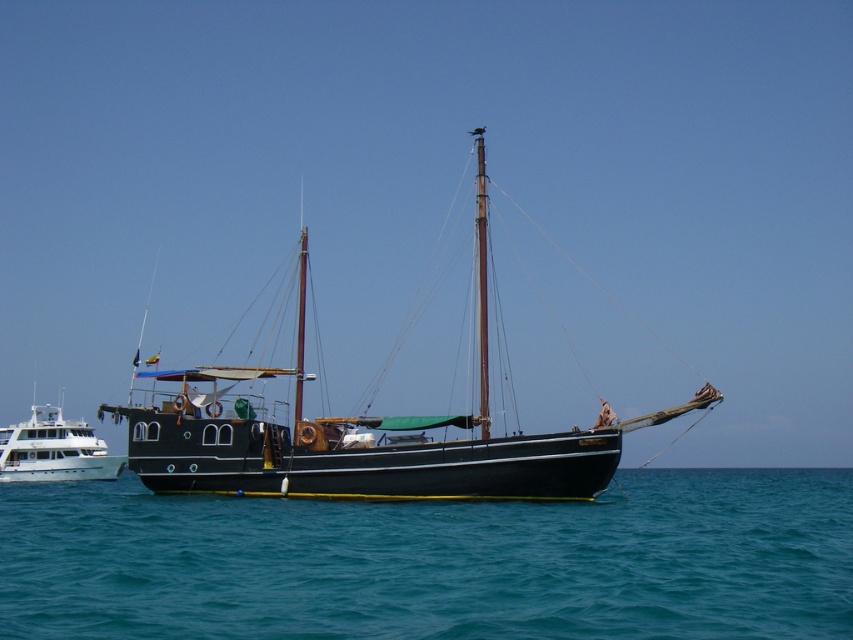
Does point (9, 618) come in front of point (519, 493)?

Yes, point (9, 618) is in front of point (519, 493).

Locate an element on the screen. blue water at lower center is located at coordinates (434, 561).

Identify the location of blue water at lower center. (434, 561).

Is point (502, 540) positioned before point (48, 456)?

Yes.

Measure the distance from blue water at lower center to white glossy yacht at left.

A distance of 49.49 meters exists between blue water at lower center and white glossy yacht at left.

Which is behind, point (109, 563) or point (56, 420)?

Positioned behind is point (56, 420).

This screenshot has height=640, width=853. Identify the location of blue water at lower center. (434, 561).

Is black polished wood sailboat at center positioned behind white glossy yacht at left?

No, it is in front of white glossy yacht at left.

Who is more distant from viewer, (480, 196) or (97, 449)?

The point (97, 449) is more distant.

Where is `black polished wood sailboat at center`? black polished wood sailboat at center is located at coordinates (363, 435).